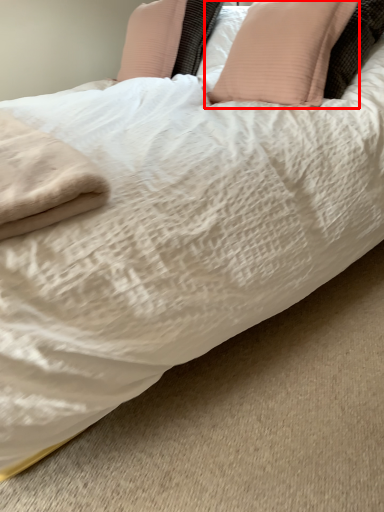
Question: Considering the relative positions of pillow (annotated by the red box) and pillow in the image provided, where is pillow (annotated by the red box) located with respect to the staircase?

Choices:
 (A) left
 (B) right

Answer: (B)